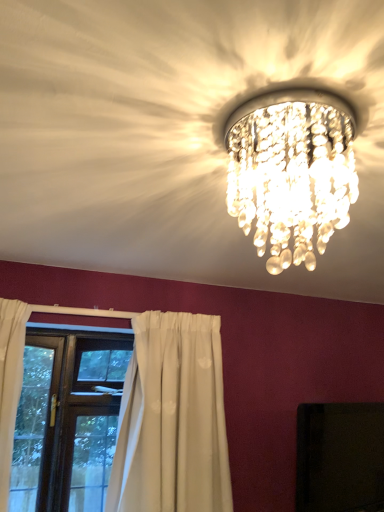
Question: Considering the positions of clear crystal chandelier at upper center and brown wooden window at lower left in the image, is clear crystal chandelier at upper center taller or shorter than brown wooden window at lower left?

Choices:
 (A) tall
 (B) short

Answer: (B)

Question: Based on their sizes in the image, would you say clear crystal chandelier at upper center is bigger or smaller than brown wooden window at lower left?

Choices:
 (A) big
 (B) small

Answer: (B)

Question: Which object is positioned farthest from the brown wooden window at lower left?

Choices:
 (A) clear crystal chandelier at upper center
 (B) black glossy tv at upper center

Answer: (A)

Question: Which of these objects is positioned farthest from the brown wooden window at lower left?

Choices:
 (A) clear crystal chandelier at upper center
 (B) black glossy tv at upper center

Answer: (A)